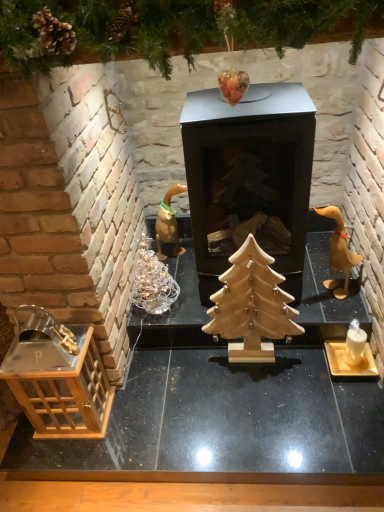
Find the location of a particular element. free space on the front side of transparent glass lantern at lower left is located at coordinates (74, 458).